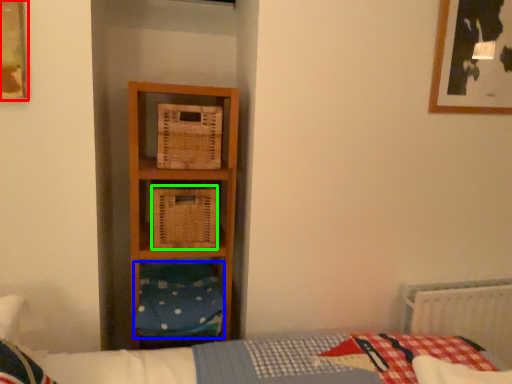
Question: Estimate the real-world distances between objects in this image. Which object is closer to picture frame (highlighted by a red box), pillow (highlighted by a blue box) or crate (highlighted by a green box)?

Choices:
 (A) pillow
 (B) crate

Answer: (B)